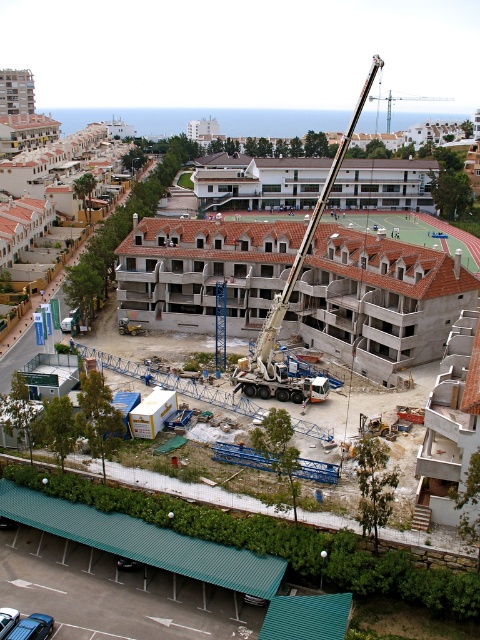
You are an inspector standing at the edge of the construction site. You notice two cranes in the scene. Which crane, the white metallic crane at center or the metallic silver crane at upper center, is closer to you?

The white metallic crane at center is closer to you because it is in front of the metallic silver crane at upper center.

You are a construction worker who needs to determine which crane is more suitable for lifting heavy materials. The white metallic crane at center has a higher load capacity than the metallic silver crane at upper center. Which crane should you choose?

You should choose the white metallic crane at center because it is bigger and has a higher load capacity than the metallic silver crane at upper center.

You are a construction worker who needs to determine which crane is better for lifting heavy materials. The white metallic crane at center and the metallic silver crane at upper center are both available. Based on their height, which one would you choose and why?

The white metallic crane at center is much taller than the metallic silver crane at upper center, so it would be better for lifting heavy materials as taller cranes generally have greater reach and lifting capacity.